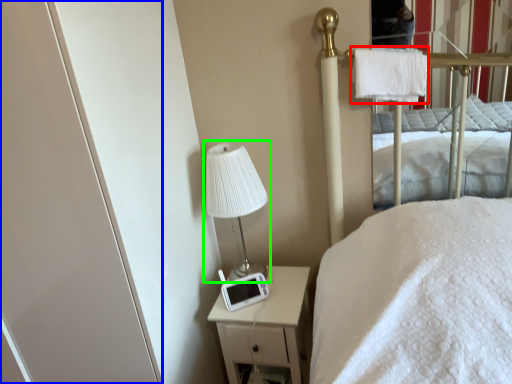
Question: Which object is positioned farthest from cloth (highlighted by a red box)? Select from screen door (highlighted by a blue box) and table lamp (highlighted by a green box).

Choices:
 (A) screen door
 (B) table lamp

Answer: (A)